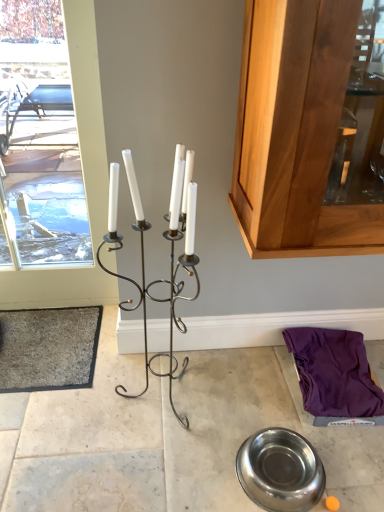
Question: Is gray carpet at lower left bigger than polished stainless steel bowl at lower center?

Choices:
 (A) yes
 (B) no

Answer: (A)

Question: Can you confirm if gray carpet at lower left is shorter than polished stainless steel bowl at lower center?

Choices:
 (A) yes
 (B) no

Answer: (A)

Question: Can we say gray carpet at lower left lies outside polished stainless steel bowl at lower center?

Choices:
 (A) no
 (B) yes

Answer: (B)

Question: Considering the relative sizes of gray carpet at lower left and polished stainless steel bowl at lower center in the image provided, is gray carpet at lower left thinner than polished stainless steel bowl at lower center?

Choices:
 (A) yes
 (B) no

Answer: (B)

Question: Is gray carpet at lower left at the left side of polished stainless steel bowl at lower center?

Choices:
 (A) no
 (B) yes

Answer: (B)

Question: Would you say gray carpet at lower left is inside or outside polished stainless steel bowl at lower center?

Choices:
 (A) outside
 (B) inside

Answer: (A)

Question: Is gray carpet at lower left bigger or smaller than polished stainless steel bowl at lower center?

Choices:
 (A) big
 (B) small

Answer: (A)

Question: Is gray carpet at lower left wider or thinner than polished stainless steel bowl at lower center?

Choices:
 (A) wide
 (B) thin

Answer: (A)

Question: From the image's perspective, is gray carpet at lower left above or below polished stainless steel bowl at lower center?

Choices:
 (A) below
 (B) above

Answer: (B)

Question: Based on their positions, is gray carpet at lower left located to the left or right of metallic silver bowl at lower center?

Choices:
 (A) right
 (B) left

Answer: (B)

Question: From a real-world perspective, is gray carpet at lower left above or below metallic silver bowl at lower center?

Choices:
 (A) below
 (B) above

Answer: (B)

Question: In terms of width, does gray carpet at lower left look wider or thinner when compared to metallic silver bowl at lower center?

Choices:
 (A) thin
 (B) wide

Answer: (A)

Question: Choose the correct answer: Is gray carpet at lower left inside metallic silver bowl at lower center or outside it?

Choices:
 (A) inside
 (B) outside

Answer: (A)

Question: Is black wrought iron candle holder at center inside or outside of gray carpet at lower left?

Choices:
 (A) inside
 (B) outside

Answer: (B)

Question: Looking at the image, does black wrought iron candle holder at center seem bigger or smaller compared to gray carpet at lower left?

Choices:
 (A) big
 (B) small

Answer: (A)